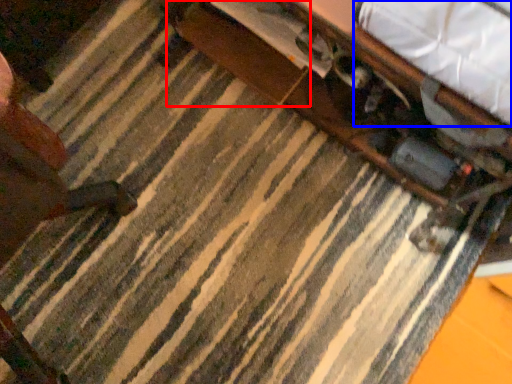
Question: Which object appears closest to the camera in this image, drawer (highlighted by a red box) or sheet (highlighted by a blue box)?

Choices:
 (A) drawer
 (B) sheet

Answer: (B)